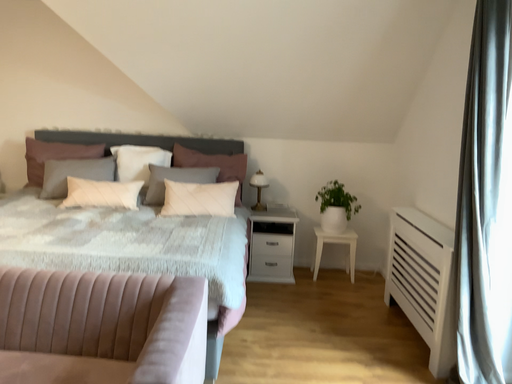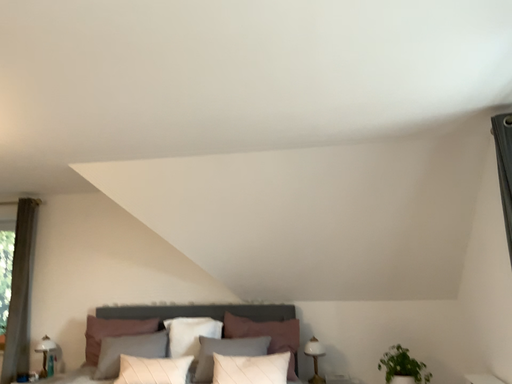
Question: How did the camera likely rotate when shooting the video?

Choices:
 (A) rotated upward
 (B) rotated downward

Answer: (A)